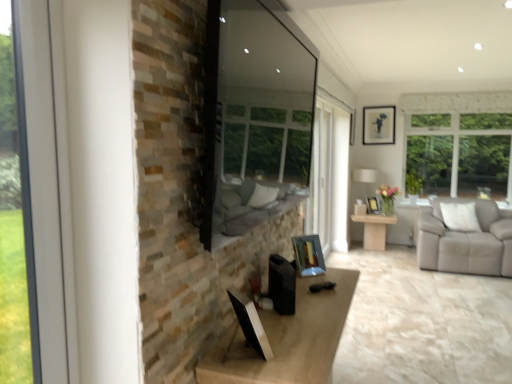
Question: Would you say transparent glass window screen at center is to the left or to the right of metallic silver picture frame at center-right, positioned as the 2th picture frame in back-to-front order, in the picture?

Choices:
 (A) left
 (B) right

Answer: (A)

Question: From a real-world perspective, is transparent glass window screen at center above or below metallic silver picture frame at center-right, which is the second picture frame from front to back?

Choices:
 (A) above
 (B) below

Answer: (A)

Question: Considering the real-world distances, which object is farthest from the white fabric lampshade at right?

Choices:
 (A) transparent glass window screen at center
 (B) metallic silver picture frame at upper right, which is the third picture frame from bottom to top
 (C) metallic silver picture frame at center, which is counted as the first picture frame, starting from the left
 (D) light wood table at center
 (E) clear glass window at left

Answer: (E)

Question: Estimate the real-world distances between objects in this image. Which object is farther from the clear glass window at left?

Choices:
 (A) transparent glass window screen at center
 (B) metallic silver picture frame at center, marked as the third picture frame in a back-to-front arrangement
 (C) metallic silver picture frame at upper right, positioned as the 1th picture frame in right-to-left order
 (D) metallic silver picture frame at center-right, the 2th picture frame from the bottom
 (E) white fabric lampshade at right

Answer: (C)